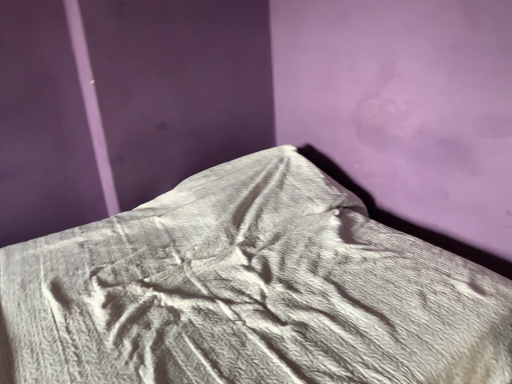
In order to face gray soft fabric at center, should I rotate leftwards or rightwards?

Turn left by 3.048 degrees to look at gray soft fabric at center.

You are a GUI agent. You are given a task and a screenshot of the screen. Output one action in this format:
    pyautogui.click(x=<x>, y=<y>)
    Task: Click on the gray soft fabric at center
    This screenshot has width=512, height=384.
    Given the screenshot: What is the action you would take?
    click(250, 292)

What do you see at coordinates (250, 292) in the screenshot? The image size is (512, 384). I see `gray soft fabric at center` at bounding box center [250, 292].

What are the coordinates of `gray soft fabric at center` in the screenshot? It's located at (250, 292).